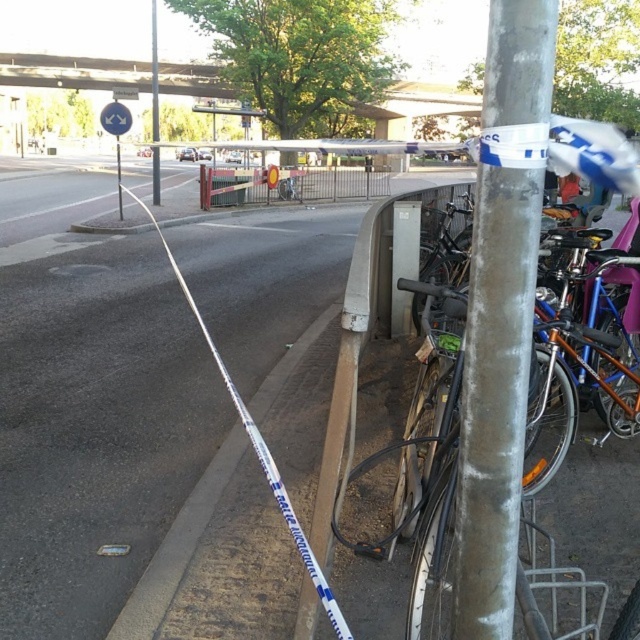
Which is above, gray concrete curb at lower left or silver metallic pole at upper center?

silver metallic pole at upper center is higher up.

From the picture: Is gray concrete curb at lower left positioned behind silver metallic pole at upper center?

Yes, it is.

Identify the location of gray concrete curb at lower left. This screenshot has height=640, width=640. (177, 547).

Between silver metallic pole at center and silver metallic pole at upper center, which one appears on the left side from the viewer's perspective?

From the viewer's perspective, silver metallic pole at upper center appears more on the left side.

Can you confirm if silver metallic pole at center is positioned to the right of silver metallic pole at upper center?

Yes, silver metallic pole at center is to the right of silver metallic pole at upper center.

Image resolution: width=640 pixels, height=640 pixels. In order to click on silver metallic pole at center in this screenshot , I will do `click(500, 312)`.

Is gray concrete curb at lower left above white plastic street sign at upper center?

No.

You are a GUI agent. You are given a task and a screenshot of the screen. Output one action in this format:
    pyautogui.click(x=<x>, y=<y>)
    Task: Click on the gray concrete curb at lower left
    
    Given the screenshot: What is the action you would take?
    pyautogui.click(x=177, y=547)

Where is `gray concrete curb at lower left`? The width and height of the screenshot is (640, 640). gray concrete curb at lower left is located at coordinates (177, 547).